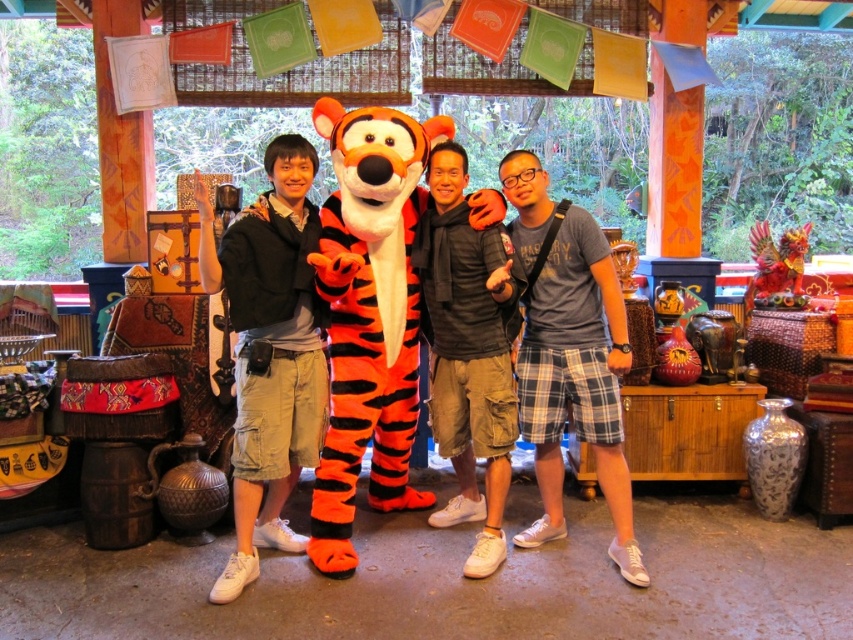
Question: From the image, what is the correct spatial relationship of matte black jacket at center in relation to blue plaid shorts at center?

Choices:
 (A) above
 (B) below

Answer: (A)

Question: Which point is closer to the camera taking this photo?

Choices:
 (A) (370, 392)
 (B) (544, 339)
 (C) (477, 388)
 (D) (265, 220)

Answer: (D)

Question: Among these objects, which one is farthest from the camera?

Choices:
 (A) orange plush tiger at center
 (B) plaid shorts at center
 (C) blue plaid shorts at center

Answer: (B)

Question: Is the position of blue plaid shorts at center less distant than that of plaid shorts at center?

Choices:
 (A) no
 (B) yes

Answer: (B)

Question: Is orange plush tiger at center positioned at the back of matte black jacket at center?

Choices:
 (A) yes
 (B) no

Answer: (A)

Question: Which point is closer to the camera?

Choices:
 (A) (273, 433)
 (B) (596, 461)
 (C) (498, 548)

Answer: (A)